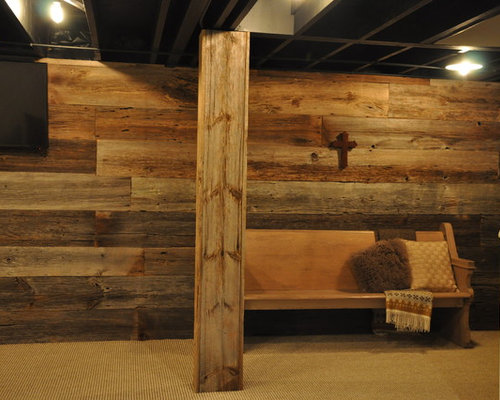
Image resolution: width=500 pixels, height=400 pixels. I want to click on light, so click(465, 66), click(57, 13).